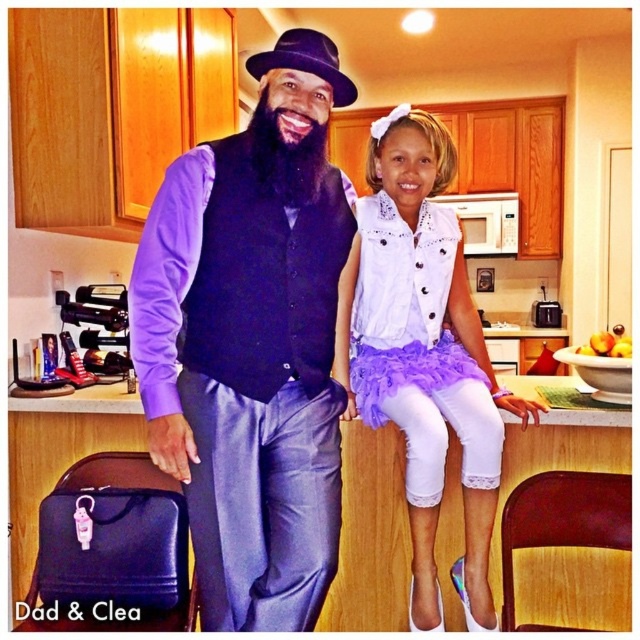
Question: Which point is closer to the camera?

Choices:
 (A) (451, 577)
 (B) (282, 339)

Answer: (B)

Question: Does matte black vest at center appear on the left side of white tulle skirt at center?

Choices:
 (A) no
 (B) yes

Answer: (B)

Question: Does white tulle skirt at center come behind white lace dress at upper right?

Choices:
 (A) yes
 (B) no

Answer: (A)

Question: Which point is closer to the camera?

Choices:
 (A) (412, 394)
 (B) (228, 548)

Answer: (B)

Question: Which of the following is the farthest from the observer?

Choices:
 (A) (371, 240)
 (B) (316, 276)

Answer: (A)

Question: Can you confirm if matte black vest at center is wider than white tulle skirt at center?

Choices:
 (A) yes
 (B) no

Answer: (B)